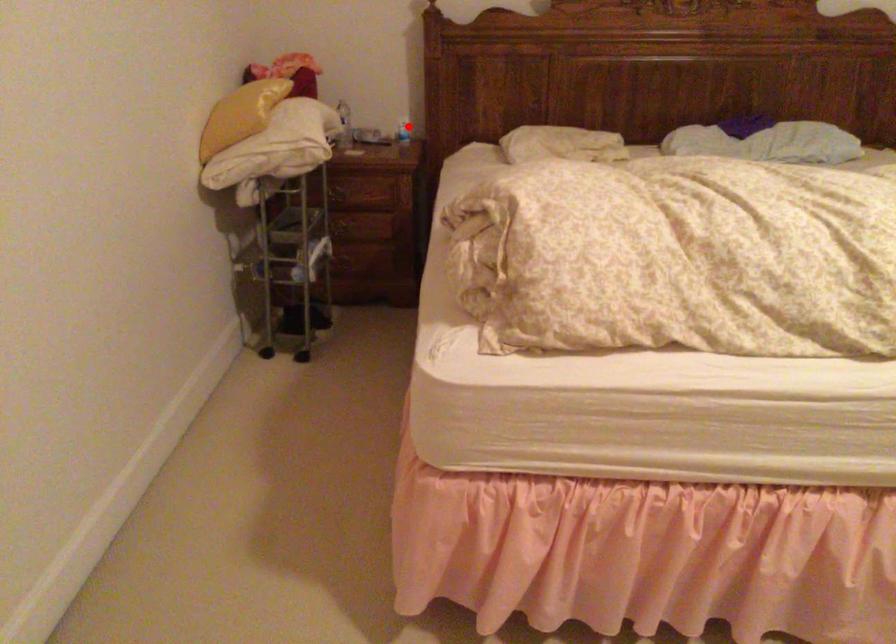
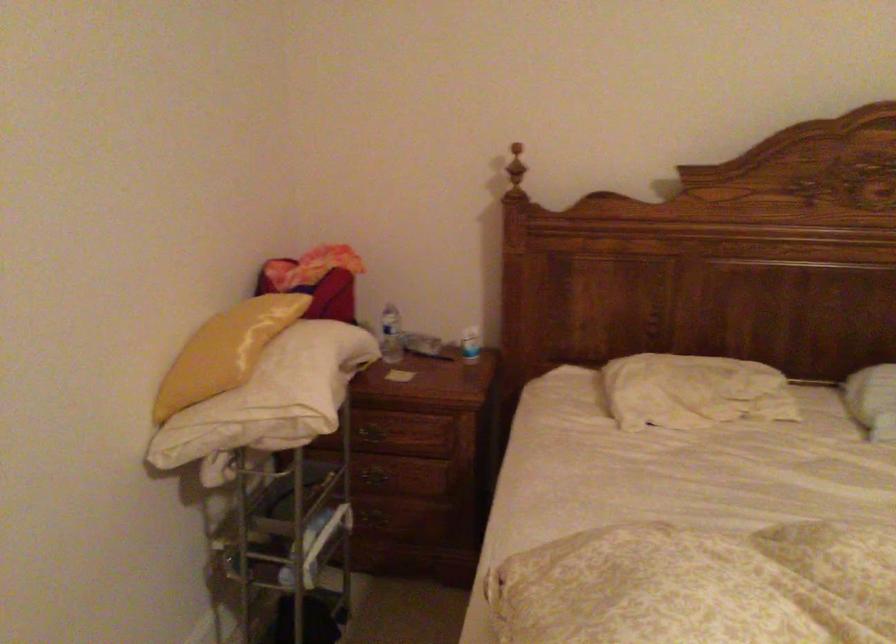
In the second image, find the point that corresponds to the highlighted location in the first image.

(470, 344)